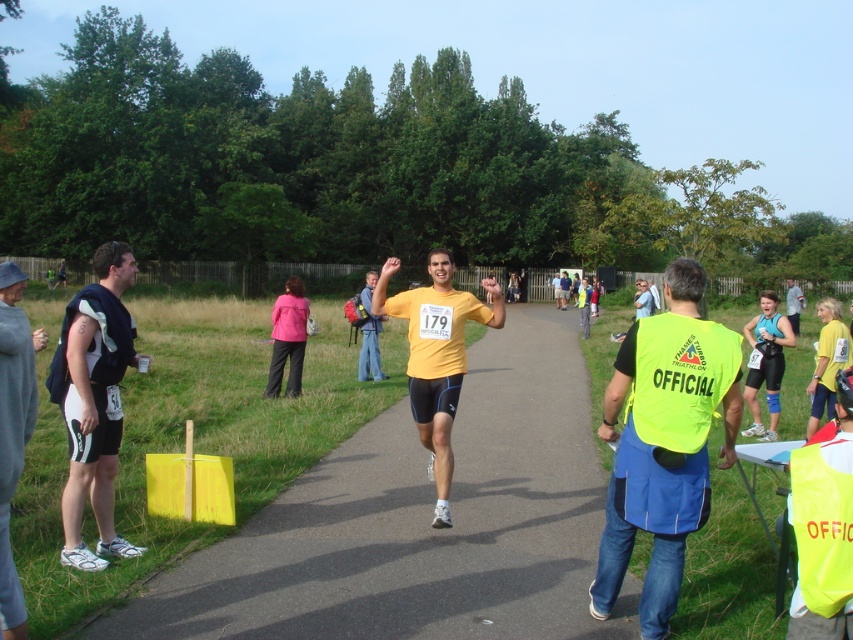
Question: Among these points, which one is farthest from the camera?

Choices:
 (A) (718, 454)
 (B) (102, 534)

Answer: (A)

Question: Is neon yellow vest at right positioned before gray sweatshirt at left?

Choices:
 (A) no
 (B) yes

Answer: (A)

Question: Observing the image, what is the correct spatial positioning of yellow fabric runner at center in reference to yellow matte triathlon suit at center?

Choices:
 (A) left
 (B) right

Answer: (B)

Question: Which of the following is the farthest from the observer?

Choices:
 (A) yellow matte vest at center
 (B) yellow matte triathlon suit at center

Answer: (B)

Question: Which point appears closest to the camera in this image?

Choices:
 (A) (809, 592)
 (B) (61, 365)
 (C) (463, 520)

Answer: (A)

Question: Can you confirm if yellow matte shirt at center is bigger than yellow matte vest at center?

Choices:
 (A) no
 (B) yes

Answer: (B)